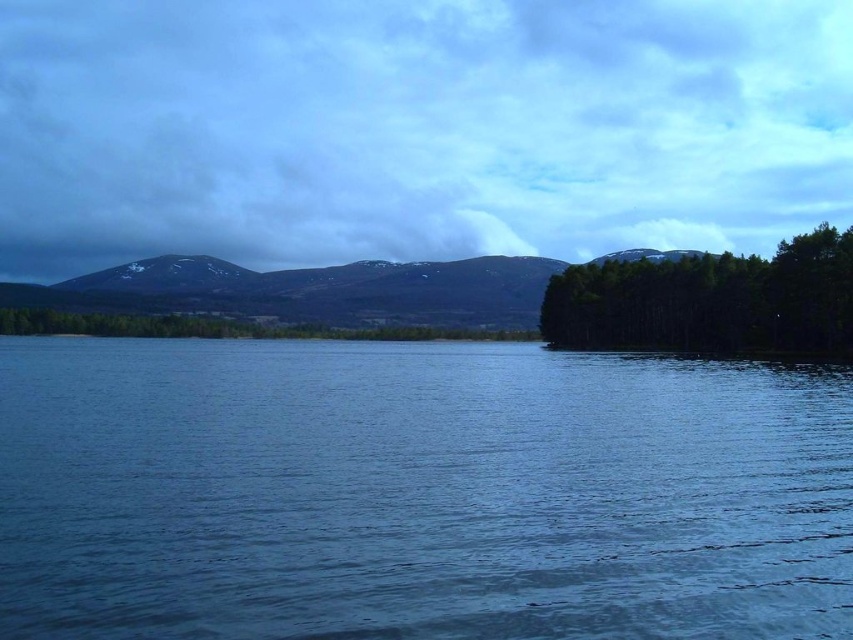
Who is positioned more to the left, blue water at center or green matte trees at right?

From the viewer's perspective, blue water at center appears more on the left side.

Who is lower down, blue water at center or green matte trees at right?

Positioned lower is blue water at center.

Is point (428, 364) positioned before point (672, 272)?

Yes.

In order to click on blue water at center in this screenshot , I will do `click(416, 492)`.